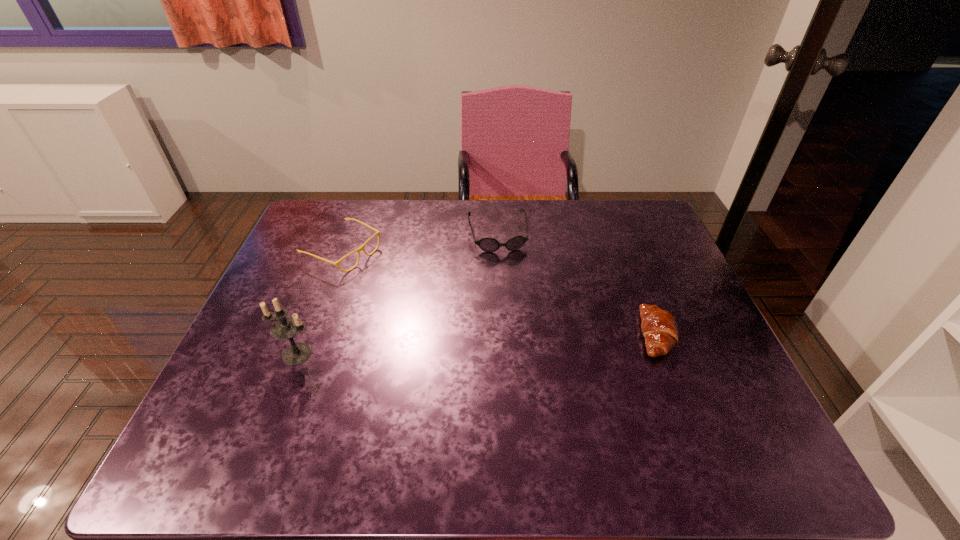
Find the location of a particular element. This screenshot has width=960, height=540. vacant area between the candle holder and the crescent roll is located at coordinates (476, 344).

You are a GUI agent. You are given a task and a screenshot of the screen. Output one action in this format:
    pyautogui.click(x=<x>, y=<y>)
    Task: Click on the free space that is in between the second object from right to left and the spectacles
    
    Given the screenshot: What is the action you would take?
    pyautogui.click(x=420, y=243)

Where is `free area in between the spectacles and the crescent roll`? Image resolution: width=960 pixels, height=540 pixels. free area in between the spectacles and the crescent roll is located at coordinates (499, 293).

Where is `unoccupied position between the tallest object and the crescent roll`? The image size is (960, 540). unoccupied position between the tallest object and the crescent roll is located at coordinates (476, 344).

Point out which object is positioned as the nearest to the spectacles. Please provide its 2D coordinates. Your answer should be formatted as a tuple, i.e. [(x, y)], where the tuple contains the x and y coordinates of a point satisfying the conditions above.

[(286, 327)]

Where is `object that is the second closest to the third object from left to right`? The height and width of the screenshot is (540, 960). object that is the second closest to the third object from left to right is located at coordinates (659, 328).

Where is `free point that satisfies the following two spatial constraints: 1. on the back side of the sunglasses; 2. on the left side of the tallest object`? The height and width of the screenshot is (540, 960). free point that satisfies the following two spatial constraints: 1. on the back side of the sunglasses; 2. on the left side of the tallest object is located at coordinates (343, 235).

Locate an element on the screen. This screenshot has height=540, width=960. free region that satisfies the following two spatial constraints: 1. on the back side of the spectacles; 2. on the right side of the third object from left to right is located at coordinates (348, 235).